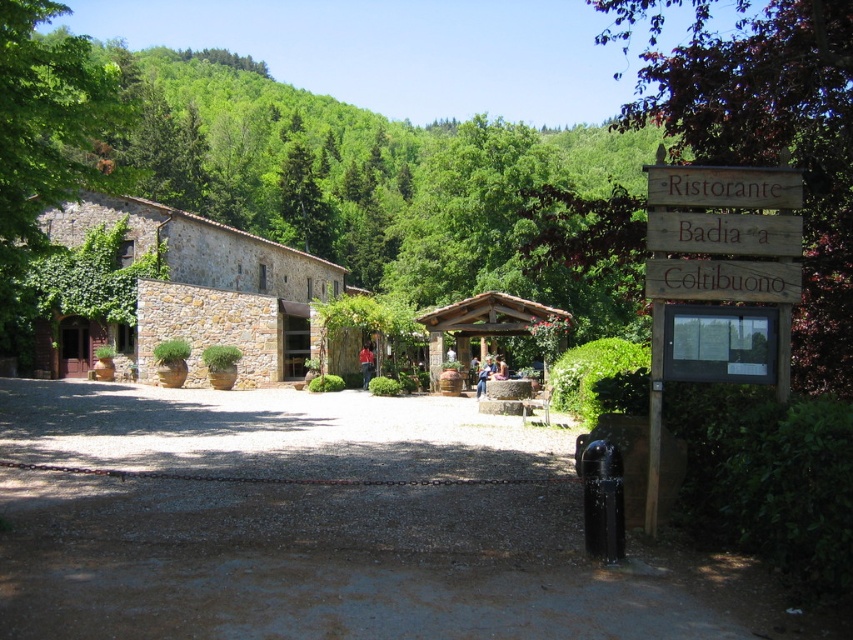
Question: Where is gravel driveway at center located in relation to wooden sign at right in the image?

Choices:
 (A) left
 (B) right

Answer: (A)

Question: Which point is closer to the camera?

Choices:
 (A) wooden sign at right
 (B) gravel driveway at center
 (C) green leafy tree at right

Answer: (B)

Question: Which object appears closest to the camera in this image?

Choices:
 (A) wooden sign at right
 (B) gravel driveway at center

Answer: (B)

Question: Does gravel driveway at center have a larger size compared to wooden sign at right?

Choices:
 (A) yes
 (B) no

Answer: (A)

Question: Does green leafy tree at right have a smaller size compared to wooden sign at right?

Choices:
 (A) no
 (B) yes

Answer: (A)

Question: Based on their relative distances, which object is farther from the wooden sign at right?

Choices:
 (A) gravel driveway at center
 (B) green leafy tree at right

Answer: (B)